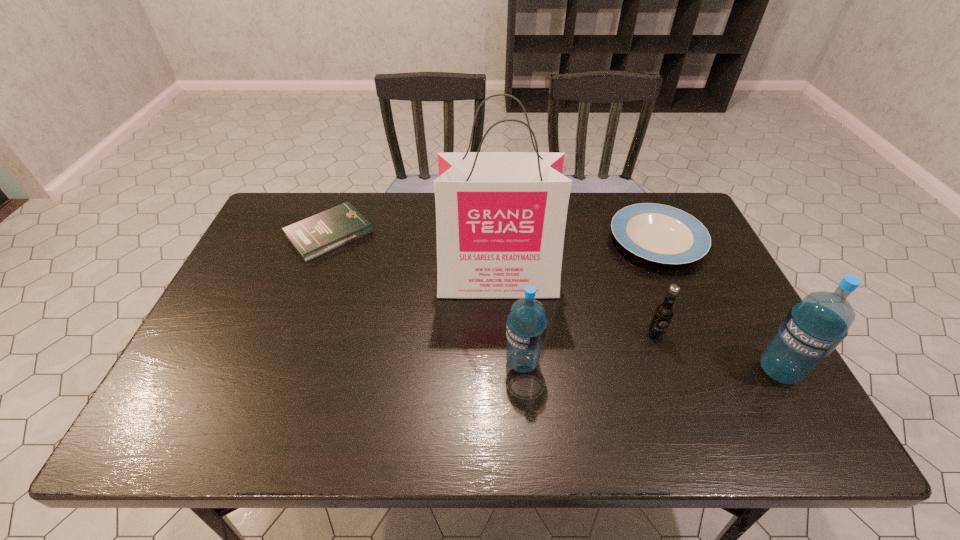
Locate an element on the screen. This screenshot has width=960, height=540. free space at the far right corner of the desktop is located at coordinates (671, 197).

Identify the location of vacant space in between the second tallest object and the fifth tallest object. (718, 306).

Where is `vacant point located between the plate and the right water bottle`? The image size is (960, 540). vacant point located between the plate and the right water bottle is located at coordinates (718, 306).

Find the location of a particular element. The height and width of the screenshot is (540, 960). vacant space in between the taller water bottle and the fourth tallest object is located at coordinates (717, 352).

Find the location of a particular element. The height and width of the screenshot is (540, 960). vacant space that is in between the book and the shopping bag is located at coordinates (414, 257).

Where is `unoccupied area between the third nearest object and the tallest object`? unoccupied area between the third nearest object and the tallest object is located at coordinates (576, 307).

This screenshot has width=960, height=540. Find the location of `free spot between the fourth tallest object and the fifth tallest object`. free spot between the fourth tallest object and the fifth tallest object is located at coordinates (656, 287).

Image resolution: width=960 pixels, height=540 pixels. What are the coordinates of `free point between the second shortest object and the fourth tallest object` in the screenshot? It's located at (656, 287).

This screenshot has height=540, width=960. What are the coordinates of `vacant area that lies between the shortest object and the shopping bag` in the screenshot? It's located at (414, 257).

Locate an element on the screen. free space between the shorter water bottle and the right water bottle is located at coordinates (650, 367).